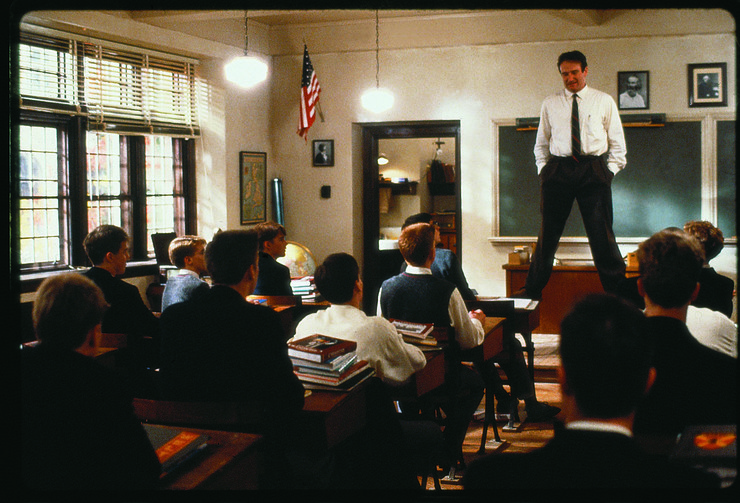
This screenshot has width=740, height=503. I want to click on the top corners of doorway frame, so click(370, 133), click(451, 136).